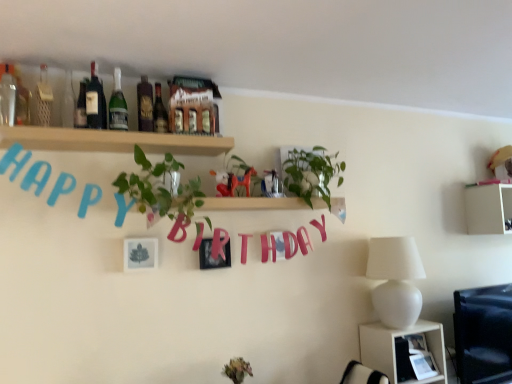
Question: Looking at their shapes, would you say matte red horse at center is wider or thinner than green leafy plant at center?

Choices:
 (A) thin
 (B) wide

Answer: (A)

Question: Considering the positions of matte red horse at center and green leafy plant at center in the image, is matte red horse at center taller or shorter than green leafy plant at center?

Choices:
 (A) tall
 (B) short

Answer: (B)

Question: Considering the real-world distances, which object is closest to the green glass bottle at upper center, which is counted as the 5th bottle, starting from the left?

Choices:
 (A) green glossy plant at upper center
 (B) metallic silver photo frame at center, the first picture frame from the back
 (C) white glossy shelf at upper right, positioned as the second shelf in top-to-bottom order
 (D) matte glass bottle at upper center, placed as the second bottle when sorted from right to left
 (E) wooden shelf at upper center, the first shelf in the front-to-back sequence

Answer: (D)

Question: Which object is the farthest from the dark brown glass bottle at upper left, the 4th bottle when ordered from right to left?

Choices:
 (A) matte glass bottle at upper center, marked as the 7th bottle in a left-to-right arrangement
 (B) wooden shelf at upper center, the 3th shelf in the back-to-front sequence
 (C) matte glass bottle at upper center, placed as the second bottle when sorted from right to left
 (D) green glass bottle at upper left, marked as the third bottle in a left-to-right arrangement
 (E) clear glass bottle at upper left, the 2th bottle viewed from the left

Answer: (A)